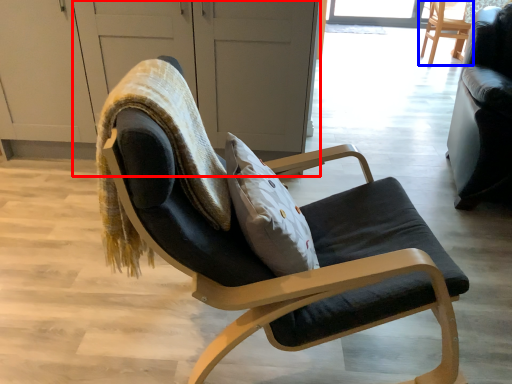
Question: Which point is closer to the camera, screen door (highlighted by a red box) or chair (highlighted by a blue box)?

Choices:
 (A) screen door
 (B) chair

Answer: (A)